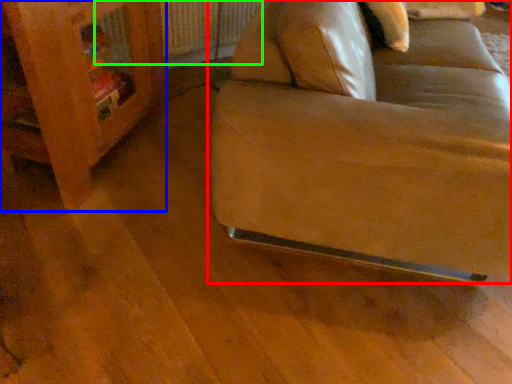
Question: Which is farther away from studio couch (highlighted by a red box)? furniture (highlighted by a blue box) or radiator (highlighted by a green box)?

Choices:
 (A) furniture
 (B) radiator

Answer: (B)